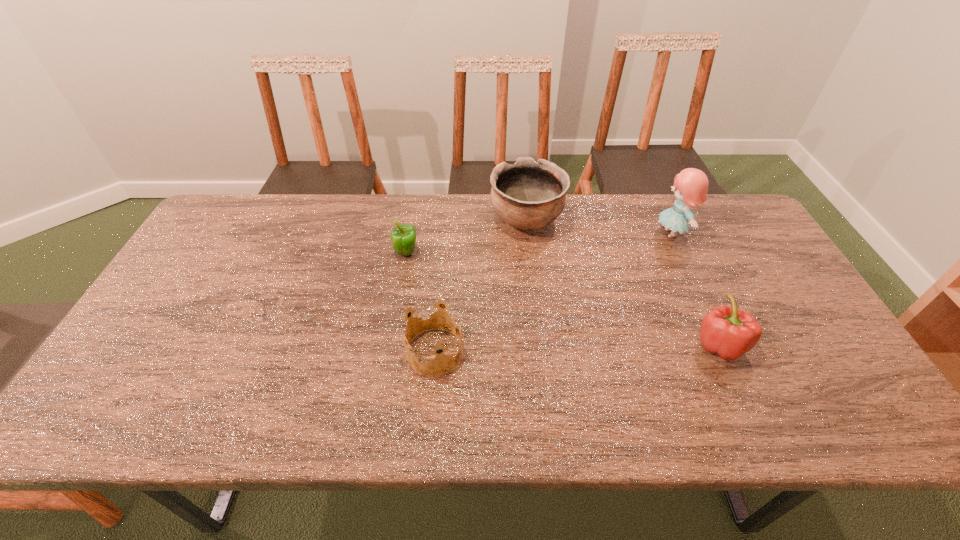
Identify the location of doll. (690, 188).

Image resolution: width=960 pixels, height=540 pixels. Identify the location of the fourth shortest object. 527,195.

At what (x,y) coordinates should I click in order to perform the action: click on the third object from left to right. Please return your answer as a coordinate pair (x, y). This screenshot has width=960, height=540. Looking at the image, I should click on (527, 195).

Where is `the left bell pepper`? The width and height of the screenshot is (960, 540). the left bell pepper is located at coordinates (403, 238).

Image resolution: width=960 pixels, height=540 pixels. What are the coordinates of `the leftmost object` in the screenshot? It's located at (403, 238).

Locate an element on the screen. the nearer bell pepper is located at coordinates (726, 331).

At what (x,y) coordinates should I click in order to perform the action: click on the second object from left to right. Please return your answer as a coordinate pair (x, y). Looking at the image, I should click on (428, 314).

Image resolution: width=960 pixels, height=540 pixels. I want to click on free space located on the front-facing side of the tallest object, so click(637, 234).

Image resolution: width=960 pixels, height=540 pixels. What are the coordinates of `blank area located 0.390m on the front-facing side of the tallest object` in the screenshot? It's located at (530, 234).

Find the location of a particular element. This screenshot has width=960, height=540. free space located 0.060m on the front-facing side of the tallest object is located at coordinates (635, 234).